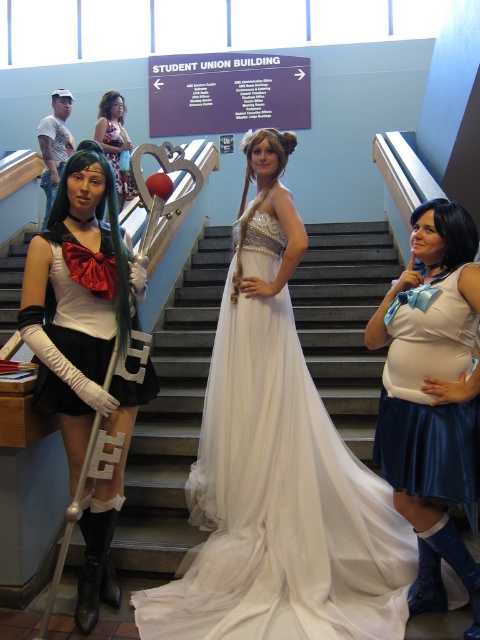
Between white satin gown at center and satin white dress at left, which one appears on the right side from the viewer's perspective?

white satin gown at center is more to the right.

Can you confirm if white satin gown at center is positioned above satin white dress at left?

Incorrect, white satin gown at center is not positioned above satin white dress at left.

Which is behind, point (218, 488) or point (109, 234)?

The point (218, 488) is more distant.

This screenshot has width=480, height=640. I want to click on white satin gown at center, so click(277, 467).

Who is positioned more to the right, matte white dress at center or floral print fabric dress at center?

From the viewer's perspective, matte white dress at center appears more on the right side.

Is matte white dress at center taller than floral print fabric dress at center?

Yes.

Find the location of a particular element. The height and width of the screenshot is (640, 480). matte white dress at center is located at coordinates (432, 396).

Does matte white dress at center have a smaller size compared to matte black dress at center?

Indeed, matte white dress at center has a smaller size compared to matte black dress at center.

Can you confirm if matte white dress at center is positioned to the left of matte black dress at center?

No, matte white dress at center is not to the left of matte black dress at center.

Identify the location of matte white dress at center. The image size is (480, 640). (432, 396).